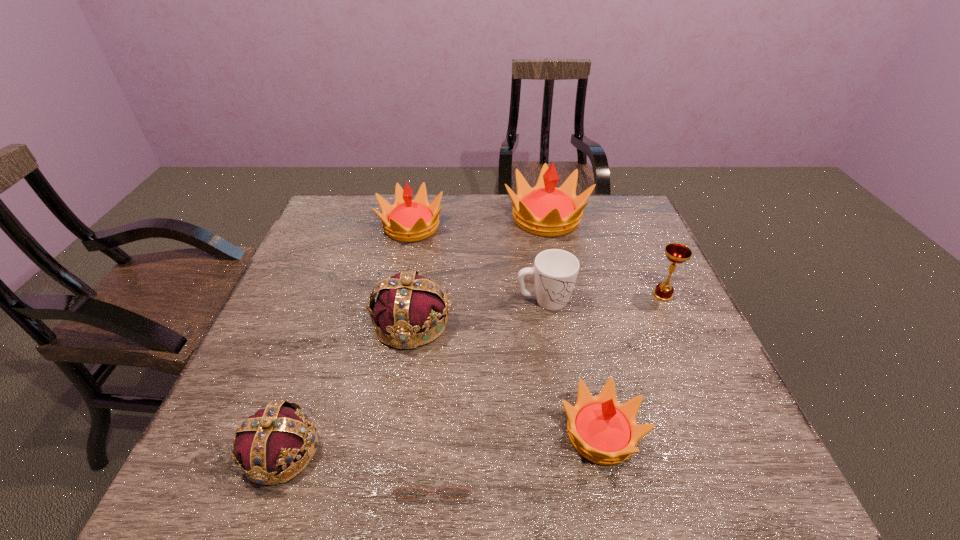
Where is `object located at the right edge`? The height and width of the screenshot is (540, 960). object located at the right edge is located at coordinates (676, 253).

Identify the location of object present at the near left corner. The width and height of the screenshot is (960, 540). 273,438.

Image resolution: width=960 pixels, height=540 pixels. What are the coordinates of `blank space at the far edge of the desktop` in the screenshot? It's located at (458, 199).

Identify the location of vacant space at the near edge of the desktop. The width and height of the screenshot is (960, 540). (658, 461).

In the image, there is a desktop. Identify the location of vacant space at the left edge. Image resolution: width=960 pixels, height=540 pixels. (349, 247).

In the image, there is a desktop. Find the location of `vacant space at the right edge`. vacant space at the right edge is located at coordinates (628, 305).

This screenshot has width=960, height=540. What are the coordinates of `vacant area at the far left corner of the desktop` in the screenshot? It's located at (348, 215).

At what (x,y) coordinates should I click in order to perform the action: click on vacant region between the nearest yellow crown and the smaller purple crown. Please return your answer as a coordinate pair (x, y). Image resolution: width=960 pixels, height=540 pixels. Looking at the image, I should click on tap(441, 443).

Where is `free spot between the farther purple crown and the rightmost object`? This screenshot has height=540, width=960. free spot between the farther purple crown and the rightmost object is located at coordinates (538, 309).

This screenshot has width=960, height=540. Find the location of `free area in between the chalice and the tallest object`. free area in between the chalice and the tallest object is located at coordinates (605, 256).